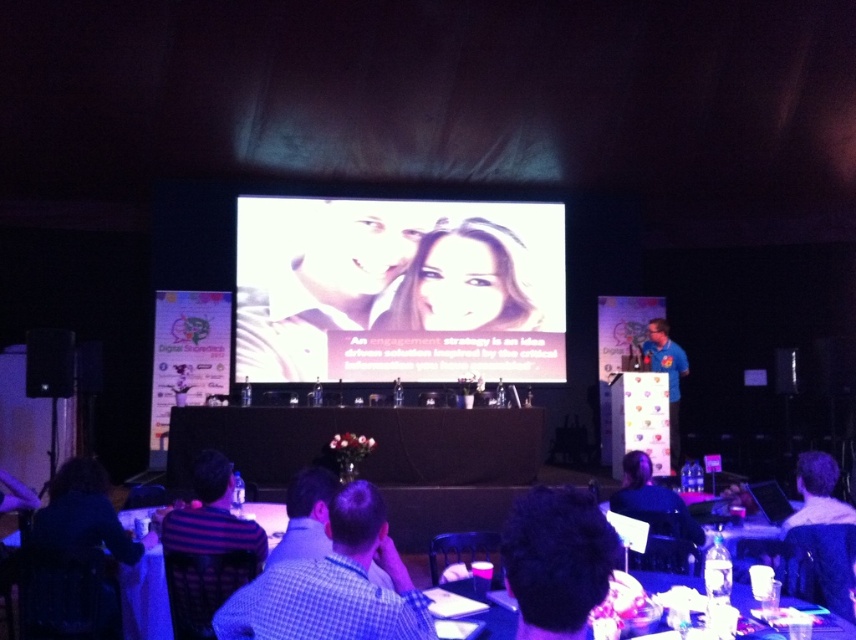
You are an attendee at this conference and you want to take a photo of the speaker. The speaker is wearing a checkered shirt at lower center and has a smooth skin face at center. Which part of the speaker should you focus on to ensure the face is clearly visible in the photo?

The smooth skin face at center occupies more space than the checkered shirt at lower center, so focusing on the smooth skin face at center will ensure it is clearly visible in the photo.